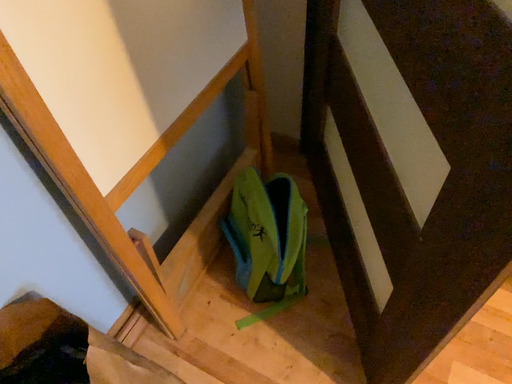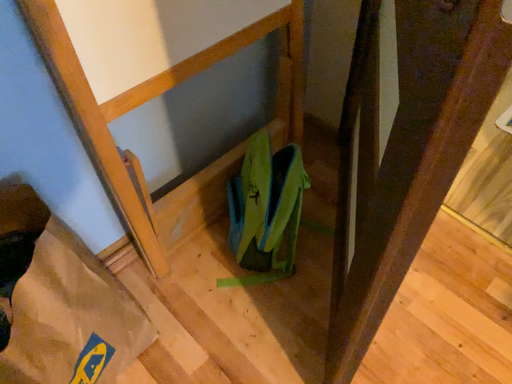
Question: Which way did the camera rotate in the video?

Choices:
 (A) rotated left
 (B) rotated right

Answer: (A)